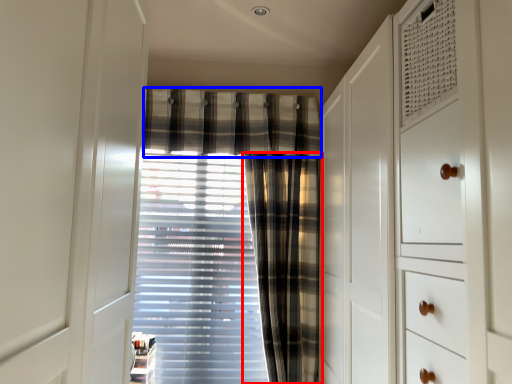
Question: Which of the following is the closest to the observer, curtain (highlighted by a red box) or plaid (highlighted by a blue box)?

Choices:
 (A) curtain
 (B) plaid

Answer: (A)